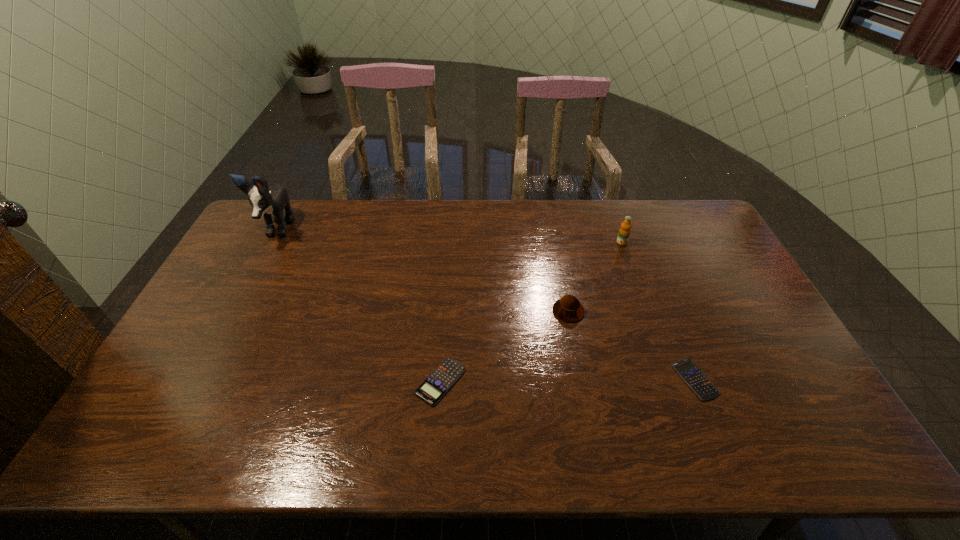
Locate an element on the screen. The height and width of the screenshot is (540, 960). vacant position located 0.260m on the label of the second tallest object is located at coordinates (642, 301).

The image size is (960, 540). What are the coordinates of `vacant space situated 0.150m on the front of the third tallest object` in the screenshot? It's located at (579, 366).

Find the location of a particular element. The width and height of the screenshot is (960, 540). free space located 0.060m on the left of the fourth tallest object is located at coordinates (393, 382).

Where is `free spot located on the back of the shortest object`? This screenshot has height=540, width=960. free spot located on the back of the shortest object is located at coordinates (663, 302).

The image size is (960, 540). What are the coordinates of `object located at the far edge` in the screenshot? It's located at [x=264, y=200].

Identify the location of object that is at the left edge. (264, 200).

Image resolution: width=960 pixels, height=540 pixels. In order to click on object that is positioned at the far left corner in this screenshot , I will do `click(264, 200)`.

This screenshot has height=540, width=960. In the image, there is a desktop. Find the location of `vacant space at the far edge`. vacant space at the far edge is located at coordinates (362, 206).

Find the location of a particular element. This screenshot has width=960, height=540. vacant region at the near edge is located at coordinates (228, 436).

Find the location of a particular element. The height and width of the screenshot is (540, 960). free space at the left edge of the desktop is located at coordinates (198, 380).